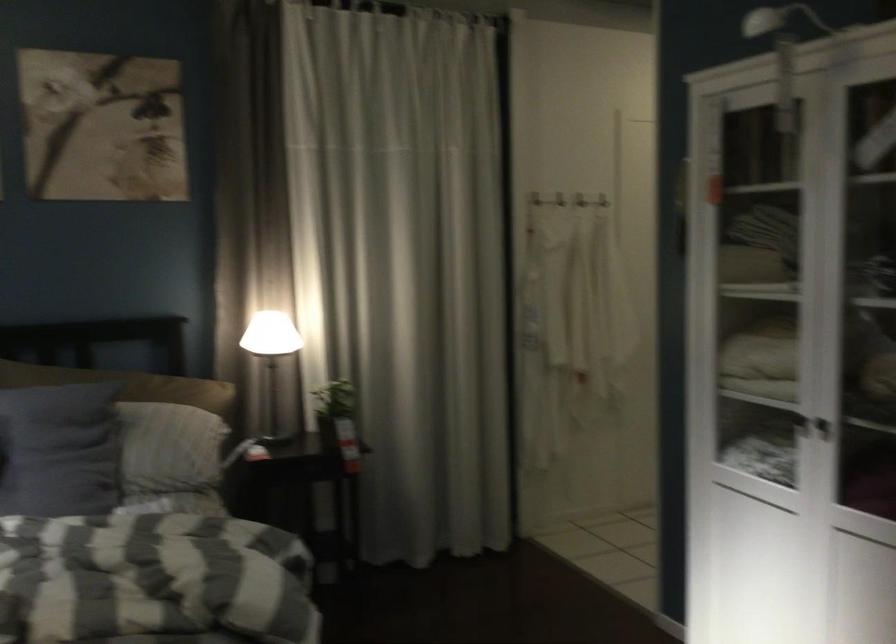
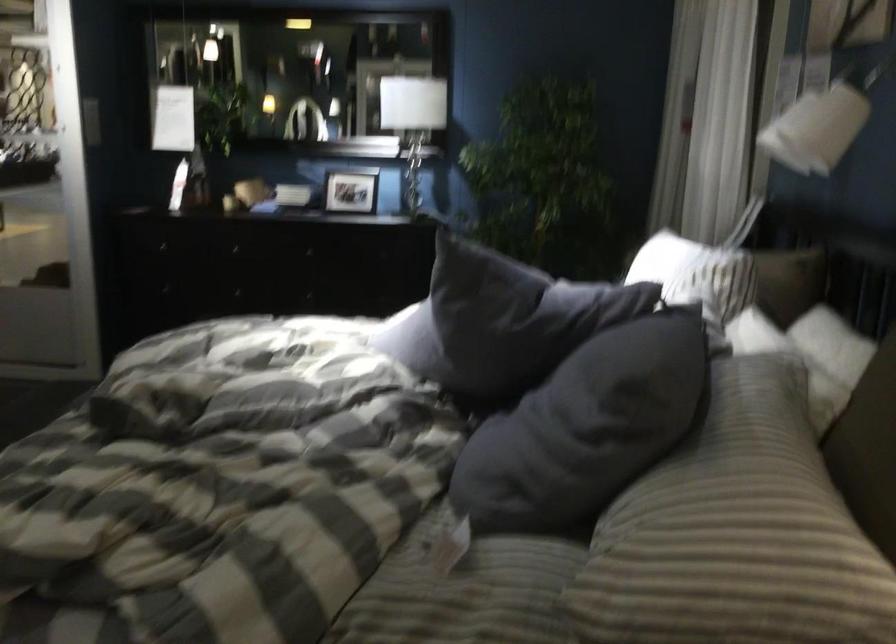
Locate, in the second image, the point that corresponds to (x=81, y=439) in the first image.

(596, 415)